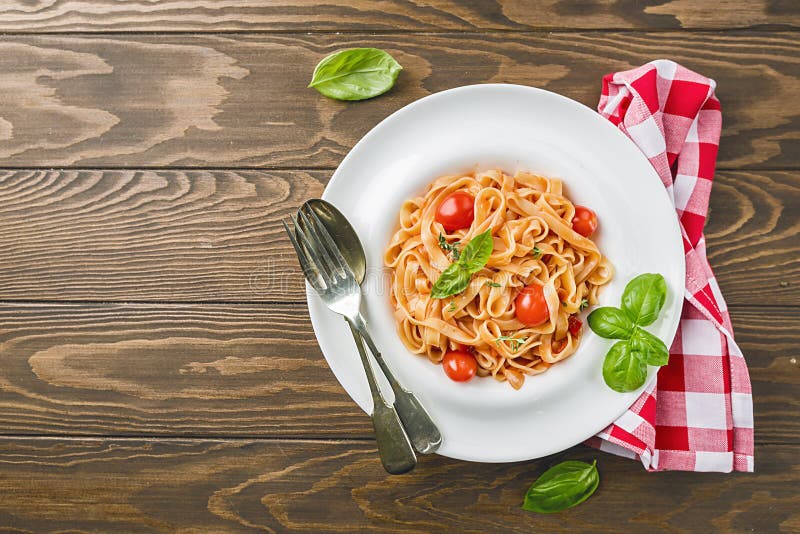
At what (x,y) coordinates should I click in order to perform the action: click on table. Please return your answer as a coordinate pair (x, y). The width and height of the screenshot is (800, 534). Looking at the image, I should click on (218, 239).